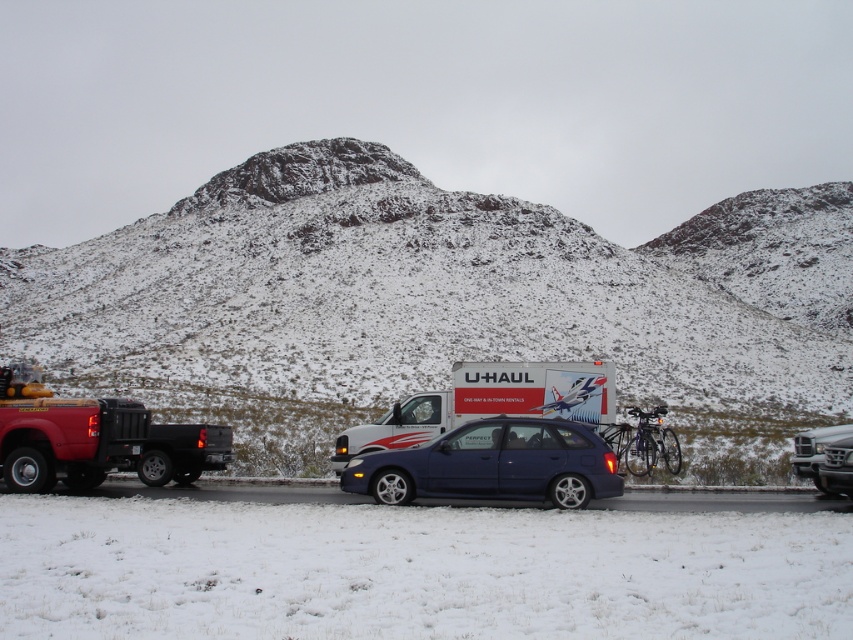
Is matte red tow truck at left shorter than metallic blue hatchback at center?

No.

Locate an element on the screen. This screenshot has width=853, height=640. matte red tow truck at left is located at coordinates (94, 438).

Which is more to the left, matte red tow truck at left or white glossy u-haul truck at center?

matte red tow truck at left

Does matte red tow truck at left lie behind white glossy u-haul truck at center?

No, it is in front of white glossy u-haul truck at center.

What do you see at coordinates (94, 438) in the screenshot? The image size is (853, 640). I see `matte red tow truck at left` at bounding box center [94, 438].

The height and width of the screenshot is (640, 853). What are the coordinates of `matte red tow truck at left` in the screenshot? It's located at (94, 438).

Does snow-covered rock at upper center lie behind matte red tow truck at left?

That is True.

What do you see at coordinates (433, 298) in the screenshot?
I see `snow-covered rock at upper center` at bounding box center [433, 298].

Locate an element on the screen. Image resolution: width=853 pixels, height=640 pixels. snow-covered rock at upper center is located at coordinates (433, 298).